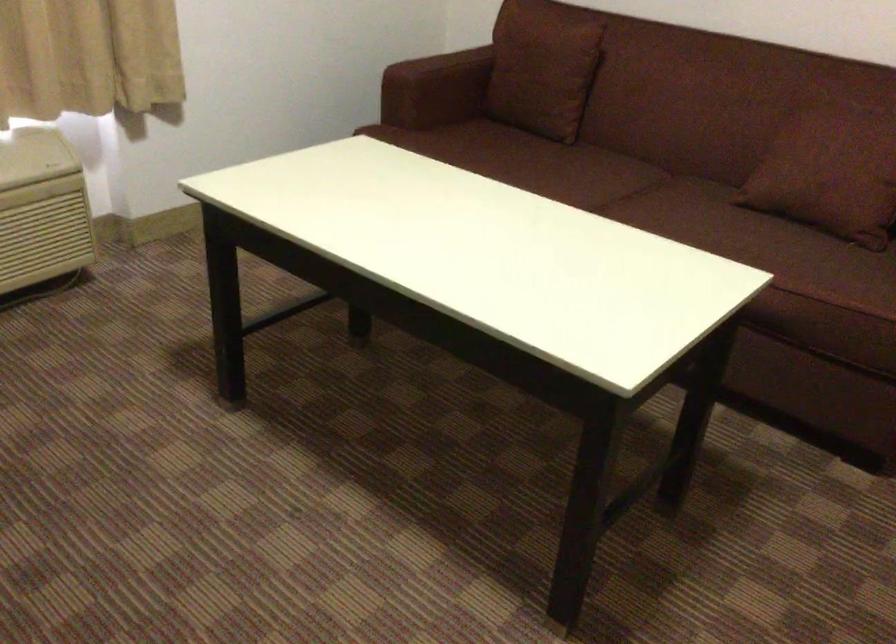
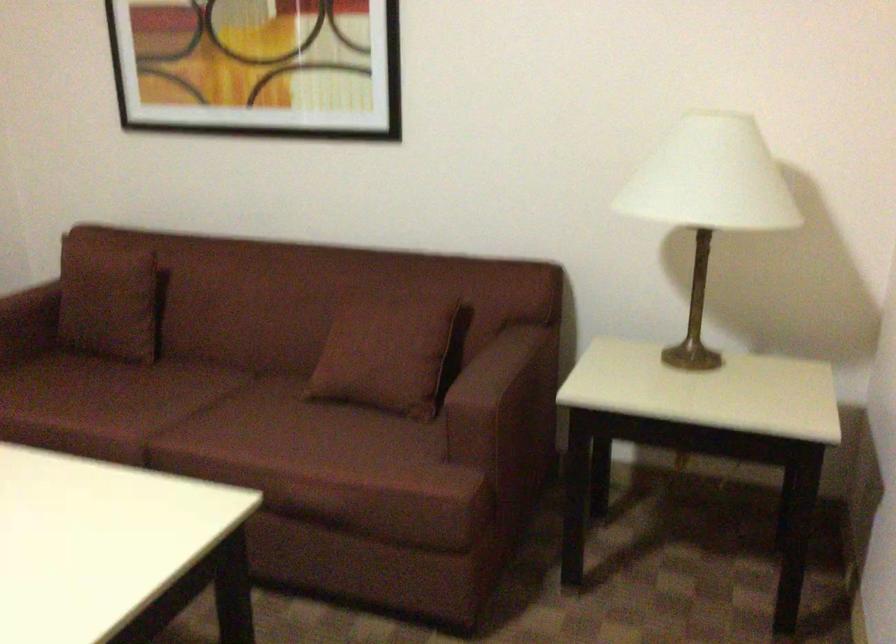
Question: The camera is either moving clockwise (left) or counter-clockwise (right) around the object. The first image is from the beginning of the video and the second image is from the end. Is the camera moving left or right when shooting the video?

Choices:
 (A) Left
 (B) Right

Answer: (A)